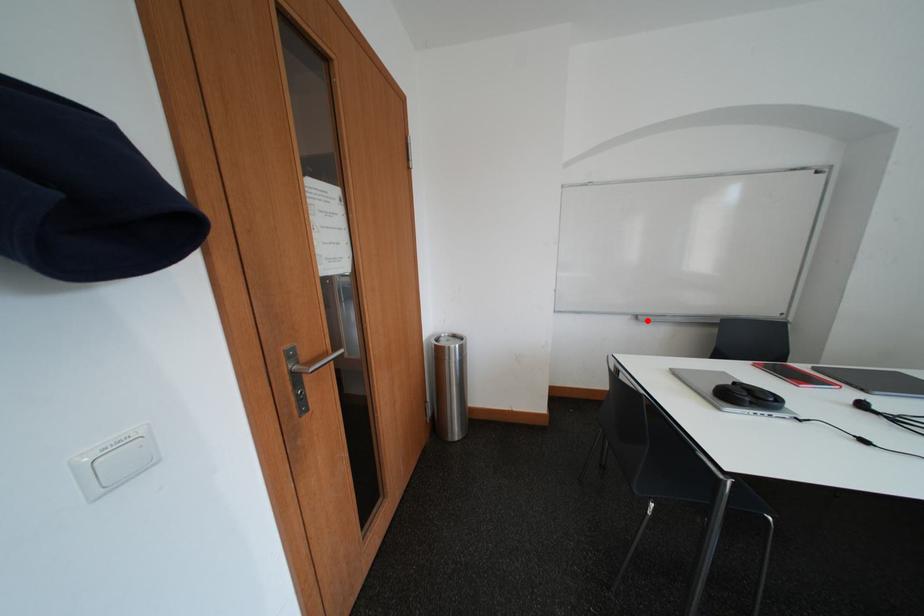
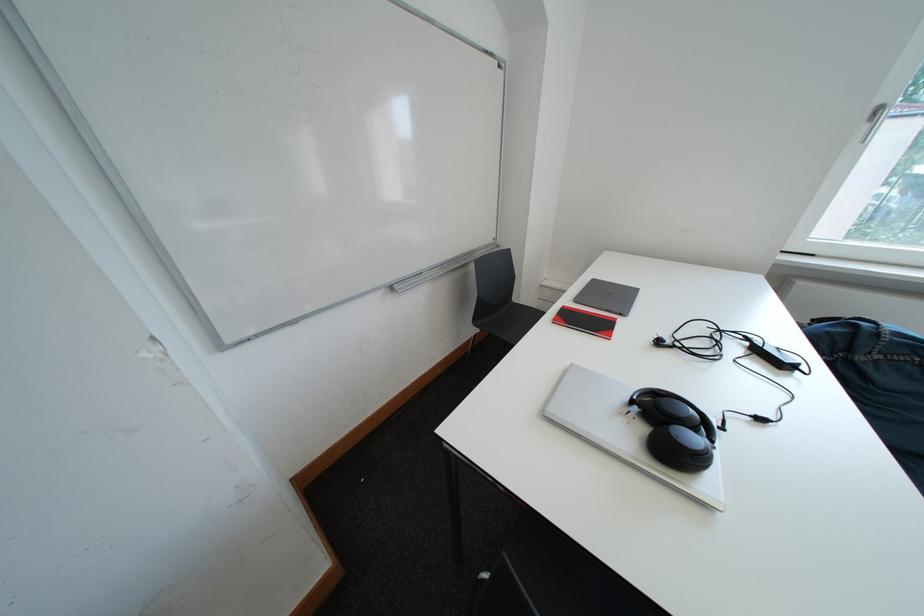
The point at the highlighted location is marked in the first image. Where is the corresponding point in the second image?

(403, 292)